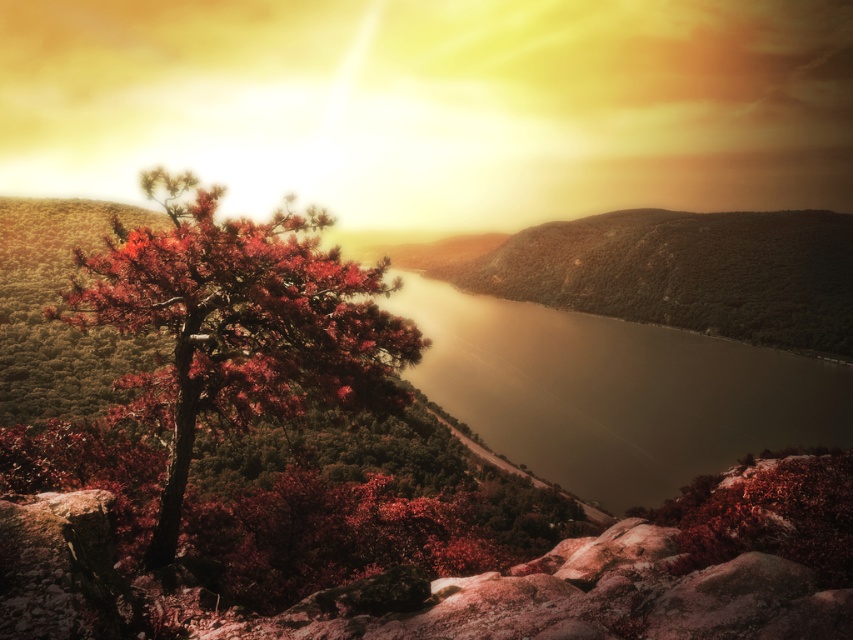
Who is shorter, smooth dark water at center or reddish-brown bark tree at left?

reddish-brown bark tree at left

Can you confirm if smooth dark water at center is positioned to the right of reddish-brown bark tree at left?

Yes, smooth dark water at center is to the right of reddish-brown bark tree at left.

I want to click on smooth dark water at center, so click(x=613, y=392).